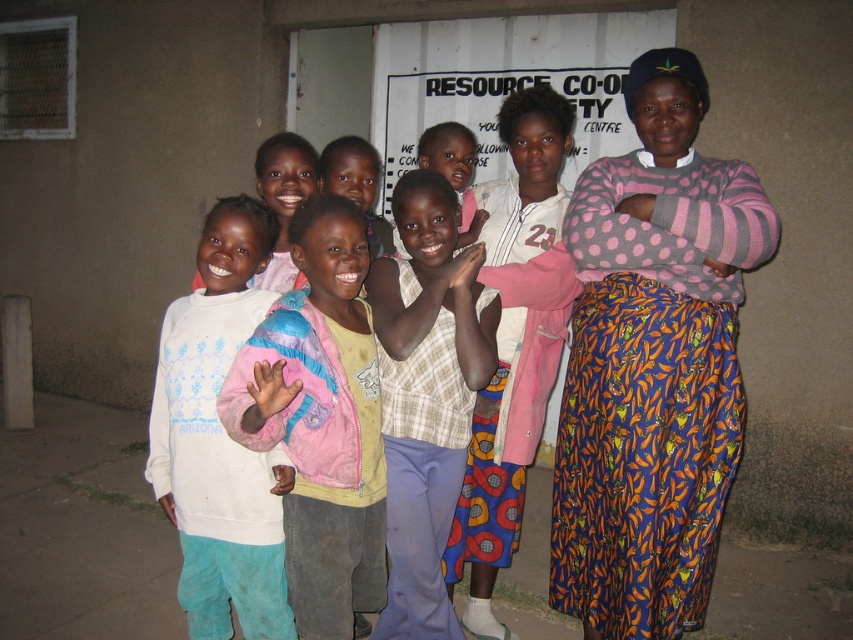
Is light blue cotton pants at center positioned in front of checkered fabric dress at center?

Yes, it is in front of checkered fabric dress at center.

Between light blue cotton pants at center and checkered fabric dress at center, which one is positioned lower?

light blue cotton pants at center is below.

Is point (238, 432) positioned after point (479, 333)?

That is False.

The height and width of the screenshot is (640, 853). I want to click on light blue cotton pants at center, so click(x=320, y=420).

Measure the distance from polka dot sweater at center to light blue cotton pants at center.

The distance of polka dot sweater at center from light blue cotton pants at center is 28.52 inches.

Does polka dot sweater at center appear over light blue cotton pants at center?

Indeed, polka dot sweater at center is positioned over light blue cotton pants at center.

Between point (596, 540) and point (299, 461), which one is positioned in front?

Positioned in front is point (299, 461).

Where is `polka dot sweater at center`? The image size is (853, 640). polka dot sweater at center is located at coordinates (653, 364).

Who is positioned more to the right, light blue cotton pants at center or white fleece sweatshirt at center?

light blue cotton pants at center is more to the right.

Between light blue cotton pants at center and white fleece sweatshirt at center, which one is positioned higher?

Positioned higher is light blue cotton pants at center.

Is point (231, 372) in front of point (190, 371)?

That is True.

You are a GUI agent. You are given a task and a screenshot of the screen. Output one action in this format:
    pyautogui.click(x=<x>, y=<y>)
    Task: Click on the light blue cotton pants at center
    This screenshot has width=853, height=640.
    Given the screenshot: What is the action you would take?
    pyautogui.click(x=320, y=420)